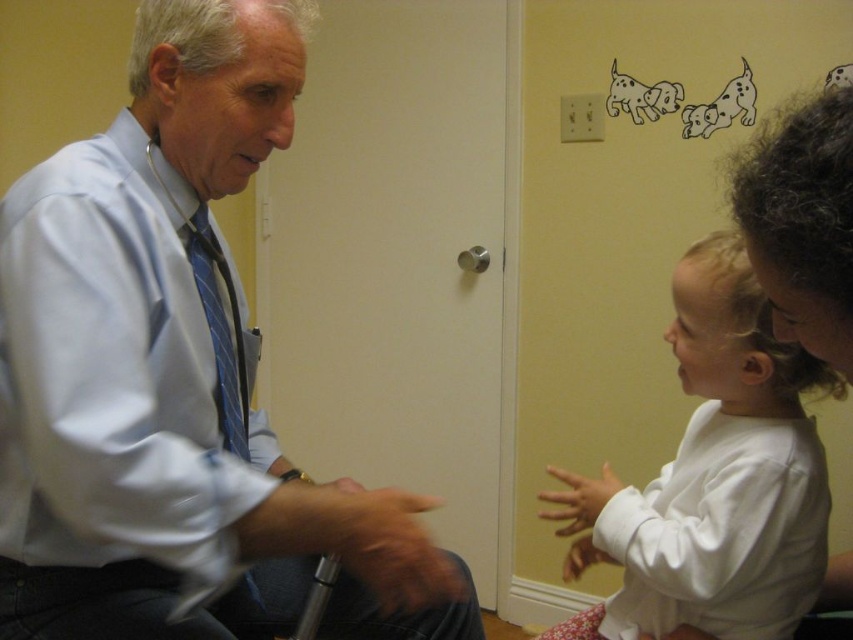
Question: Which object is positioned closest to the light blue shirt at left?

Choices:
 (A) blue striped tie at left
 (B) matte blue dress shirt at left
 (C) white soft shirt at right

Answer: (B)

Question: Is light blue shirt at left thinner than blue striped tie at left?

Choices:
 (A) yes
 (B) no

Answer: (B)

Question: Is matte blue dress shirt at left thinner than white soft shirt at right?

Choices:
 (A) yes
 (B) no

Answer: (A)

Question: Among these points, which one is nearest to the camera?

Choices:
 (A) (207, 314)
 (B) (692, 531)
 (C) (187, 493)

Answer: (C)

Question: Is white soft shirt at right wider than blue striped tie at left?

Choices:
 (A) no
 (B) yes

Answer: (B)

Question: Which point is farther from the camera taking this photo?

Choices:
 (A) (241, 445)
 (B) (230, 516)

Answer: (A)